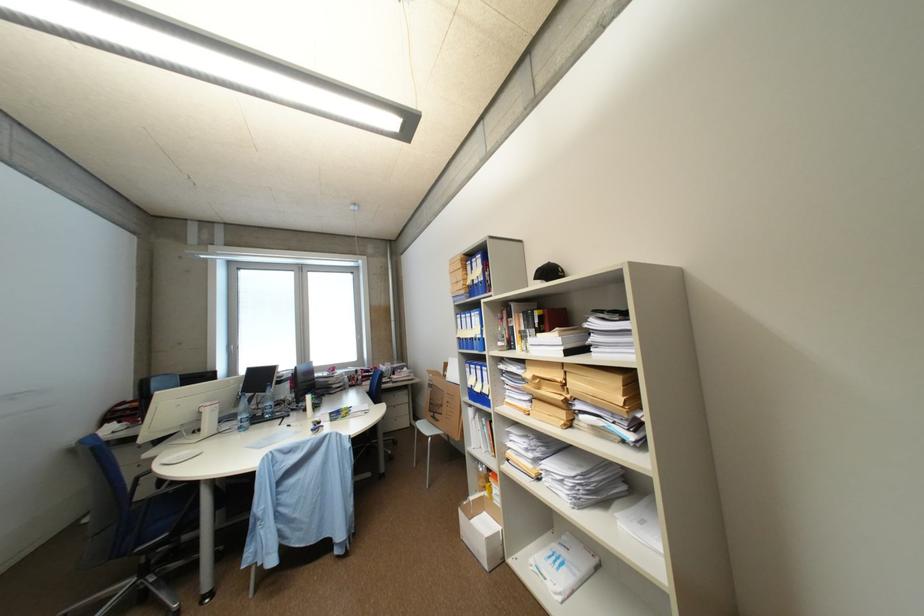
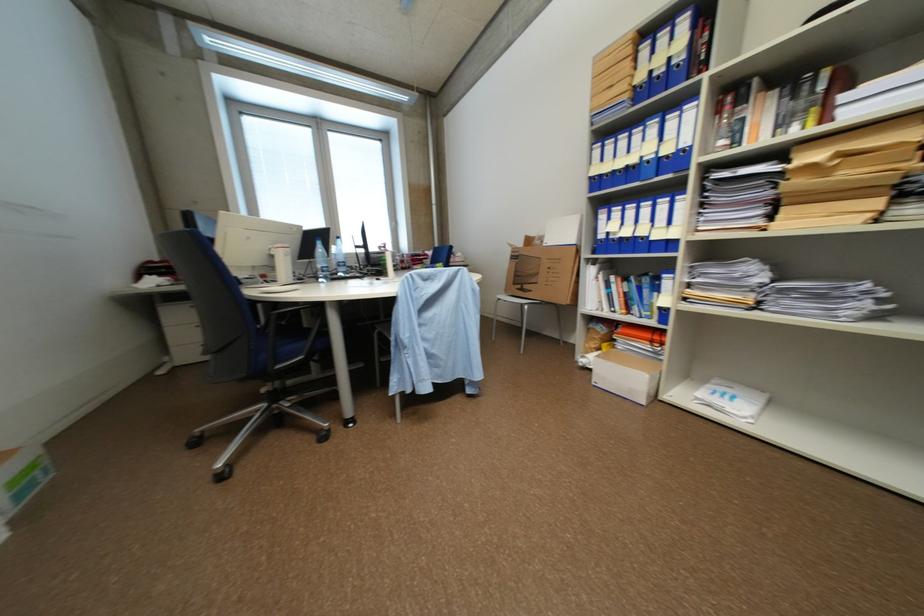
Question: In a continuous first-person perspective shot, in which direction is the camera moving?

Choices:
 (A) Left
 (B) Right
 (C) Forward
 (D) Backward

Answer: (A)